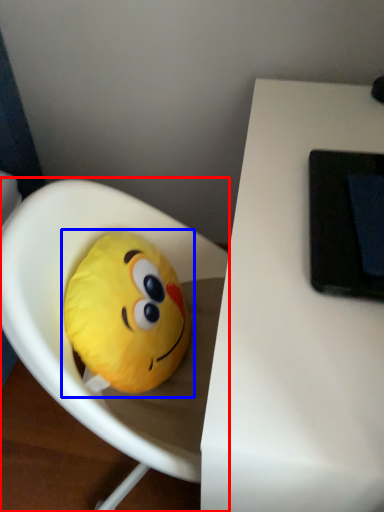
Question: Which object is further to the camera taking this photo, toy (highlighted by a red box) or toy (highlighted by a blue box)?

Choices:
 (A) toy
 (B) toy

Answer: (B)